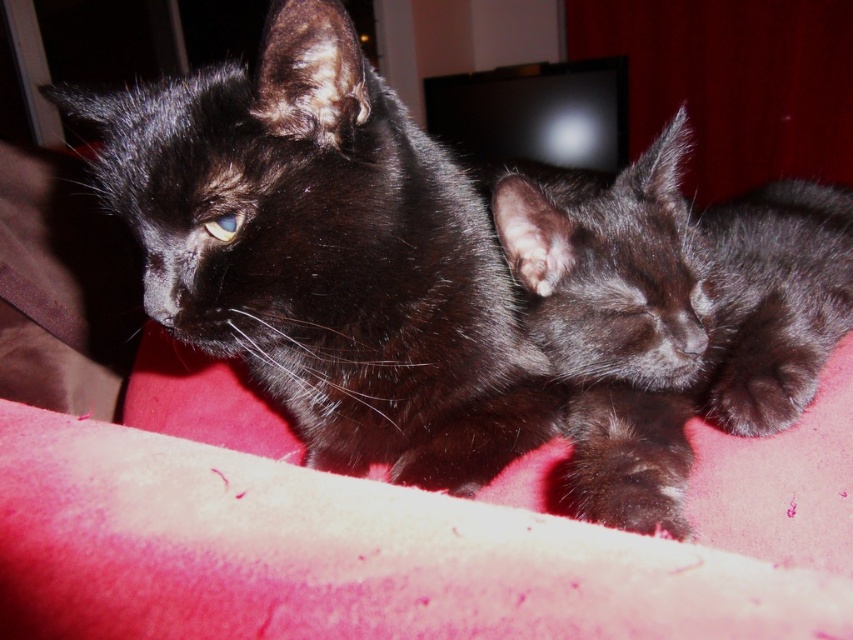
Who is more forward, (247, 252) or (648, 349)?

Positioned in front is point (247, 252).

Who is positioned more to the left, shiny black cat at upper left or shiny black kitten at center?

Positioned to the left is shiny black cat at upper left.

This screenshot has width=853, height=640. I want to click on shiny black cat at upper left, so click(x=328, y=253).

I want to click on shiny black cat at upper left, so click(x=328, y=253).